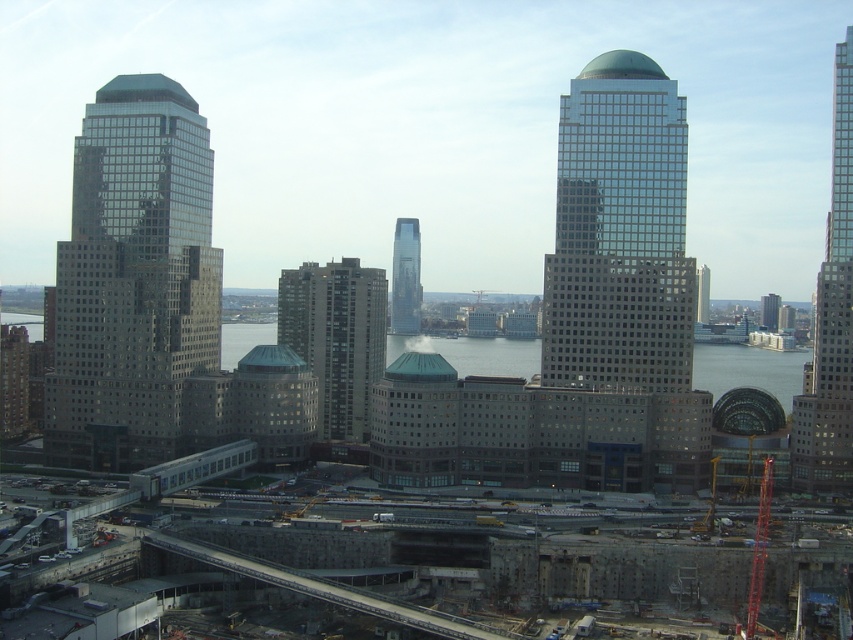
Does glassy steel skyscraper at right have a lesser width compared to dark gray concrete building at center?

Correct, glassy steel skyscraper at right's width is less than dark gray concrete building at center's.

Can you confirm if glassy steel skyscraper at right is wider than dark gray concrete building at center?

Incorrect, glassy steel skyscraper at right's width does not surpass dark gray concrete building at center's.

Between point (824, 458) and point (288, 285), which one is positioned behind?

The point (288, 285) is behind.

In order to click on glassy steel skyscraper at right in this screenshot , I will do `click(830, 321)`.

Between shiny glass skyscraper at left and glassy steel skyscraper at center, which one has less height?

glassy steel skyscraper at center

Is shiny glass skyscraper at left positioned behind glassy steel skyscraper at center?

No, shiny glass skyscraper at left is in front of glassy steel skyscraper at center.

Which is in front, point (123, 188) or point (409, 244)?

Positioned in front is point (123, 188).

Locate an element on the screen. shiny glass skyscraper at left is located at coordinates (132, 278).

Is shiny glass skyscraper at left thinner than glassy steel skyscraper at right?

No.

How distant is shiny glass skyscraper at left from glassy steel skyscraper at right?

The distance of shiny glass skyscraper at left from glassy steel skyscraper at right is 107.45 meters.

Identify the location of shiny glass skyscraper at left. The image size is (853, 640). pos(132,278).